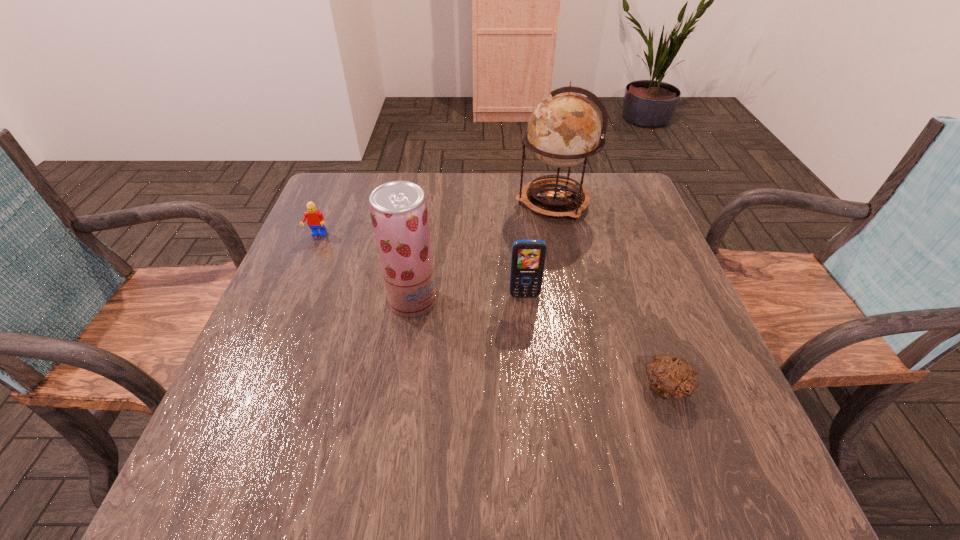
I want to click on free space located at the center of the tallest object, so click(x=416, y=202).

Where is `vacant space located 0.230m at the center of the tallest object`? This screenshot has width=960, height=540. vacant space located 0.230m at the center of the tallest object is located at coordinates (433, 202).

The height and width of the screenshot is (540, 960). What are the coordinates of `vacant area located 0.220m on the back of the fruit juice` in the screenshot? It's located at (424, 226).

Locate an element on the screen. This screenshot has width=960, height=540. free space located on the screen of the cellular telephone is located at coordinates (538, 432).

What are the coordinates of `vacant region located on the front-facing side of the fourth nearest object` in the screenshot? It's located at (265, 359).

This screenshot has width=960, height=540. Identify the location of free space located 0.150m on the left of the muffin. 562,388.

At what (x,y) coordinates should I click in order to perform the action: click on object that is positioned at the far edge. Please return your answer as a coordinate pair (x, y). The image size is (960, 540). Looking at the image, I should click on (564, 129).

Identify the location of object that is at the left edge. (315, 220).

Where is `globe positioned at the right edge`? globe positioned at the right edge is located at coordinates (564, 129).

The image size is (960, 540). I want to click on muffin at the right edge, so click(x=671, y=377).